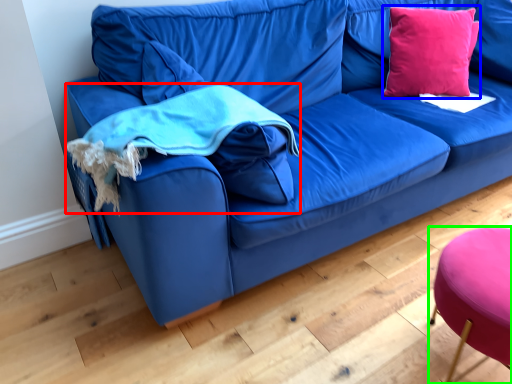
Question: Considering the real-world distances, which object is closest to cloth (highlighted by a red box)? throw pillow (highlighted by a blue box) or stool (highlighted by a green box).

Choices:
 (A) throw pillow
 (B) stool

Answer: (B)